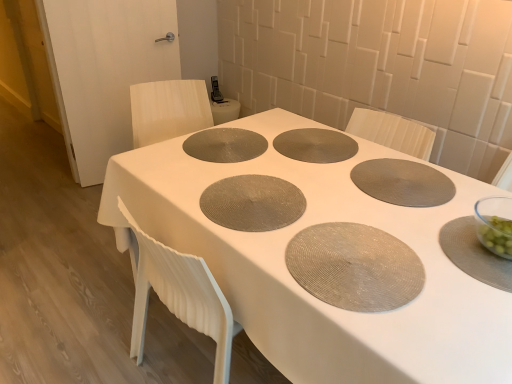
You are a GUI agent. You are given a task and a screenshot of the screen. Output one action in this format:
    pyautogui.click(x=<x>, y=<y>)
    Task: Click on the empty space that is in between matte gray placemat at center right, marked as the first pizza pan in a right-to-left arrangement, and matte gray placemat at center, marked as the 1th oval in a back-to-front arrangement
    Image resolution: width=512 pixels, height=384 pixels.
    Given the screenshot: What is the action you would take?
    pyautogui.click(x=305, y=158)